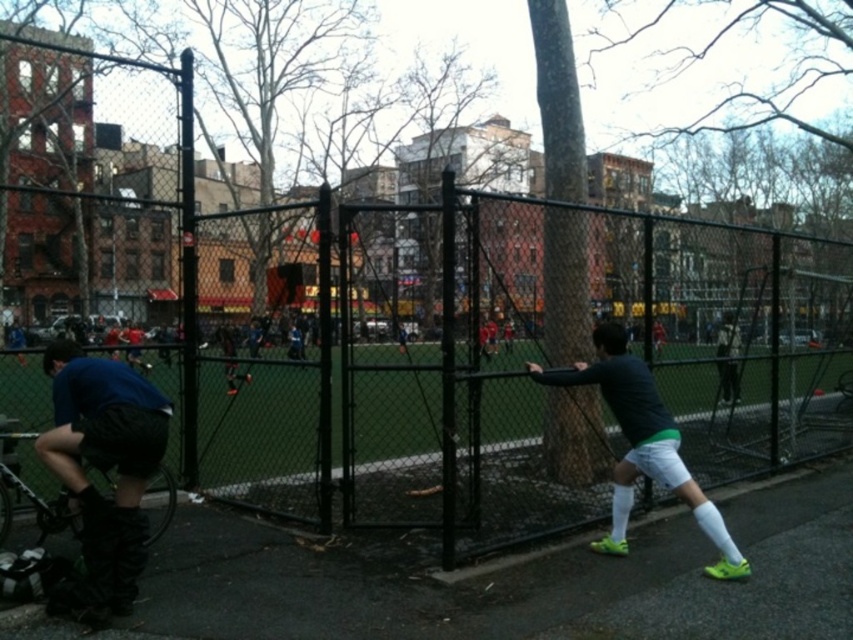
You are a photographer standing at the center of the soccer field. You want to take a photo that includes both the matte blue shirt at lower left and the dark gray matte shirt at right. Given that your camera has a maximum horizontal field of view of 2.5 meters at this distance, will you be able to capture both people in a single photo?

The matte blue shirt at lower left and dark gray matte shirt at right are 3.00 meters apart from each other. Since the camera can only capture 2.5 meters horizontally, the distance between them exceeds the camera capabilities. Therefore, you cannot capture both in a single photo.

In the scene shown: You are a photographer positioned at the back of the soccer field. You want to take a photo that includes both the matte blue shirt at lower left and the dark gray matte shirt at right. Which person should you focus on first to ensure both are in the frame?

You should focus on the matte blue shirt at lower left first because it is closer to you than the dark gray matte shirt at right, ensuring both are in the frame.